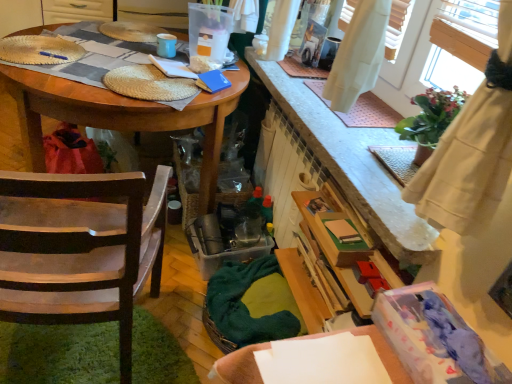
Question: From a real-world perspective, is wooden table at left above or below wooden chair at left?

Choices:
 (A) above
 (B) below

Answer: (B)

Question: Based on their sizes in the image, would you say wooden table at left is bigger or smaller than wooden chair at left?

Choices:
 (A) big
 (B) small

Answer: (A)

Question: Is wooden table at left taller or shorter than wooden chair at left?

Choices:
 (A) tall
 (B) short

Answer: (B)

Question: Is wooden chair at left situated inside wooden table at left or outside?

Choices:
 (A) outside
 (B) inside

Answer: (A)

Question: In the image, is wooden chair at left positioned in front of or behind wooden table at left?

Choices:
 (A) front
 (B) behind

Answer: (A)

Question: Is wooden chair at left wider or thinner than wooden table at left?

Choices:
 (A) wide
 (B) thin

Answer: (B)

Question: From a real-world perspective, is wooden chair at left above or below wooden table at left?

Choices:
 (A) below
 (B) above

Answer: (B)